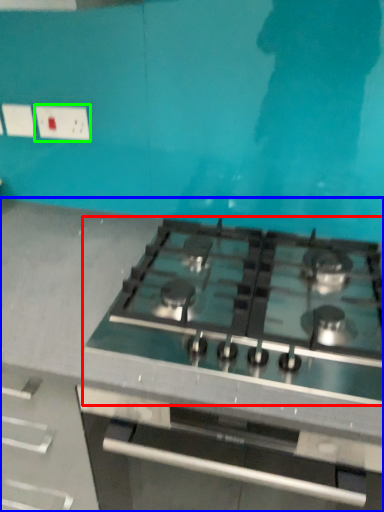
Question: Estimate the real-world distances between objects in this image. Which object is farther from gas stove (highlighted by a red box), countertop (highlighted by a blue box) or electric outlet (highlighted by a green box)?

Choices:
 (A) countertop
 (B) electric outlet

Answer: (B)